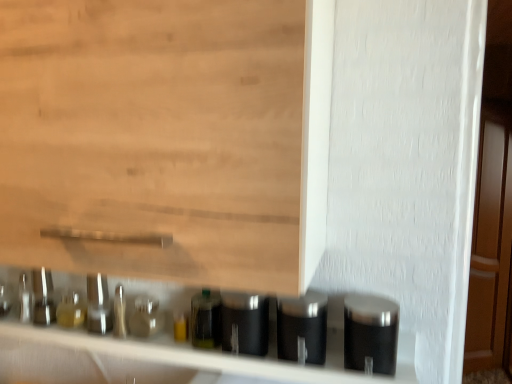
What do you see at coordinates (154, 344) in the screenshot? I see `black matte canisters at lower center` at bounding box center [154, 344].

Where is `wooden door at right`? wooden door at right is located at coordinates (490, 243).

Identify the location of translucent glass bottle at center. This screenshot has height=384, width=512. (205, 319).

Where is `satin silver canister at lower center, which is counted as the 2th silver, starting from the right`? satin silver canister at lower center, which is counted as the 2th silver, starting from the right is located at coordinates (302, 328).

Is translucent glass bottle at center shorter than satin metallic canister at center, marked as the third silver in a right-to-left arrangement?

Yes.

Looking at this image, is translucent glass bottle at center touching satin metallic canister at center, marked as the third silver in a right-to-left arrangement?

Yes.

Locate an element on the screen. bottle behind the satin metallic canister at center, marked as the third silver in a right-to-left arrangement is located at coordinates (205, 319).

Is point (210, 310) closer or farther from the camera than point (239, 352)?

Point (210, 310) is positioned farther from the camera compared to point (239, 352).

The width and height of the screenshot is (512, 384). What are the coordinates of `the 1st silver counting from the right side of the black matte canisters at lower center` in the screenshot? It's located at (245, 323).

From the image's perspective, is black matte canisters at lower center above or below satin metallic canister at center, marked as the third silver in a right-to-left arrangement?

Based on their image positions, black matte canisters at lower center is located beneath satin metallic canister at center, marked as the third silver in a right-to-left arrangement.

Which is in front, black matte canisters at lower center or satin metallic canister at center, which is counted as the 1th silver, starting from the left?

black matte canisters at lower center is more forward.

Would you say black matte canisters at lower center is a long distance from satin metallic canister at center, marked as the third silver in a right-to-left arrangement?

That's not correct — black matte canisters at lower center is a little close to satin metallic canister at center, marked as the third silver in a right-to-left arrangement.

Would you say satin black container at right, which is the first silver in right-to-left order, is a long distance from satin metallic canister at center, marked as the third silver in a right-to-left arrangement?

Actually, satin black container at right, which is the first silver in right-to-left order, and satin metallic canister at center, marked as the third silver in a right-to-left arrangement, are a little close together.

Is satin black container at right, arranged as the third silver when viewed from the left, smaller than satin metallic canister at center, marked as the third silver in a right-to-left arrangement?

No.

Starting from the satin metallic canister at center, marked as the third silver in a right-to-left arrangement, which silver is the 2nd one in front? Please provide its 2D coordinates.

[(370, 334)]

Which object is closer to the camera taking this photo, satin black container at right, arranged as the third silver when viewed from the left, or satin metallic canister at center, which is counted as the 1th silver, starting from the left?

satin black container at right, arranged as the third silver when viewed from the left, is more forward.

Is satin metallic canister at center, which is counted as the 1th silver, starting from the left, shorter than translucent glass bottle at center?

No, satin metallic canister at center, which is counted as the 1th silver, starting from the left, is not shorter than translucent glass bottle at center.

From the image's perspective, does satin metallic canister at center, which is counted as the 1th silver, starting from the left, appear lower than translucent glass bottle at center?

Answer: No, from the image's perspective, satin metallic canister at center, which is counted as the 1th silver, starting from the left, is not beneath translucent glass bottle at center.

From the picture: Which object is positioned more to the left, satin metallic canister at center, marked as the third silver in a right-to-left arrangement, or translucent glass bottle at center?

Positioned to the left is translucent glass bottle at center.

Is satin metallic canister at center, marked as the third silver in a right-to-left arrangement, directly adjacent to translucent glass bottle at center?

Yes.

Consider the image. From a real-world perspective, between satin silver canister at lower center, which appears as the 2th silver when viewed from the left, and satin black container at right, arranged as the third silver when viewed from the left, who is vertically higher?

satin black container at right, arranged as the third silver when viewed from the left, from a real-world perspective.

Is satin silver canister at lower center, which appears as the 2th silver when viewed from the left, outside of satin black container at right, arranged as the third silver when viewed from the left?

That's correct, satin silver canister at lower center, which appears as the 2th silver when viewed from the left, is outside of satin black container at right, arranged as the third silver when viewed from the left.

Does point (279, 342) appear closer or farther from the camera than point (355, 326)?

Point (279, 342) is farther from the camera than point (355, 326).

Is black matte canisters at lower center not within satin black container at right, arranged as the third silver when viewed from the left?

Indeed, black matte canisters at lower center is completely outside satin black container at right, arranged as the third silver when viewed from the left.

Does black matte canisters at lower center turn towards satin black container at right, which is the first silver in right-to-left order?

No, black matte canisters at lower center is not turned towards satin black container at right, which is the first silver in right-to-left order.

From their relative heights in the image, would you say black matte canisters at lower center is taller or shorter than satin black container at right, arranged as the third silver when viewed from the left?

Clearly, black matte canisters at lower center is shorter compared to satin black container at right, arranged as the third silver when viewed from the left.

Which point is more forward, (x=127, y=297) or (x=362, y=301)?

Point (x=362, y=301)

Considering the relative sizes of wooden door at right and satin metallic canister at center, which is counted as the 1th silver, starting from the left, in the image provided, is wooden door at right wider than satin metallic canister at center, which is counted as the 1th silver, starting from the left,?

Yes.

Image resolution: width=512 pixels, height=384 pixels. What are the coordinates of `door on the right of satin metallic canister at center, which is counted as the 1th silver, starting from the left` in the screenshot? It's located at (490, 243).

Which is behind, wooden door at right or satin metallic canister at center, which is counted as the 1th silver, starting from the left?

wooden door at right.

Is wooden door at right facing towards satin metallic canister at center, marked as the third silver in a right-to-left arrangement?

No, wooden door at right is not turned towards satin metallic canister at center, marked as the third silver in a right-to-left arrangement.

At what (x,y) coordinates should I click in order to perform the action: click on the 1st silver to the right of the translucent glass bottle at center, counting from the anchor's position. Please return your answer as a coordinate pair (x, y). This screenshot has height=384, width=512. Looking at the image, I should click on click(245, 323).

The image size is (512, 384). Identify the location of the 3rd silver above the black matte canisters at lower center (from the image's perspective). (245, 323).

Based on their spatial positions, is wooden door at right or satin metallic canister at center, which is counted as the 1th silver, starting from the left, closer to satin black container at right, which is the first silver in right-to-left order?

satin metallic canister at center, which is counted as the 1th silver, starting from the left.

From the image, which object appears to be farther from black matte canisters at lower center, satin metallic canister at center, which is counted as the 1th silver, starting from the left, or satin black container at right, which is the first silver in right-to-left order?

The object further to black matte canisters at lower center is satin black container at right, which is the first silver in right-to-left order.

Looking at the image, which one is located further to satin metallic canister at center, marked as the third silver in a right-to-left arrangement, black matte canisters at lower center or wooden door at right?

wooden door at right.

Which object lies further to the anchor point translucent glass bottle at center, wooden door at right or satin metallic canister at center, which is counted as the 1th silver, starting from the left?

The object further to translucent glass bottle at center is wooden door at right.

Based on their spatial positions, is black matte canisters at lower center or satin silver canister at lower center, which is counted as the 2th silver, starting from the right, closer to translucent glass bottle at center?

satin silver canister at lower center, which is counted as the 2th silver, starting from the right, lies closer to translucent glass bottle at center than the other object.

Based on their spatial positions, is satin metallic canister at center, marked as the third silver in a right-to-left arrangement, or satin black container at right, arranged as the third silver when viewed from the left, further from satin silver canister at lower center, which appears as the 2th silver when viewed from the left?

satin black container at right, arranged as the third silver when viewed from the left, is further to satin silver canister at lower center, which appears as the 2th silver when viewed from the left.

Considering their positions, is satin metallic canister at center, marked as the third silver in a right-to-left arrangement, positioned further to satin silver canister at lower center, which is counted as the 2th silver, starting from the right, than wooden door at right?

The object further to satin silver canister at lower center, which is counted as the 2th silver, starting from the right, is wooden door at right.

From the image, which object appears to be nearer to wooden door at right, satin black container at right, which is the first silver in right-to-left order, or satin silver canister at lower center, which is counted as the 2th silver, starting from the right?

Among the two, satin black container at right, which is the first silver in right-to-left order, is located nearer to wooden door at right.

The image size is (512, 384). In order to click on bottle situated between black matte canisters at lower center and satin silver canister at lower center, which is counted as the 2th silver, starting from the right, from left to right in this screenshot , I will do `click(205, 319)`.

Locate an element on the screen. This screenshot has height=384, width=512. bottle positioned between satin silver canister at lower center, which is counted as the 2th silver, starting from the right, and wooden door at right from near to far is located at coordinates (205, 319).

In order to click on silver between satin silver canister at lower center, which appears as the 2th silver when viewed from the left, and wooden door at right, along the z-axis in this screenshot , I will do `click(245, 323)`.

The width and height of the screenshot is (512, 384). In order to click on bottle between black matte canisters at lower center and satin black container at right, arranged as the third silver when viewed from the left, in the horizontal direction in this screenshot , I will do `click(205, 319)`.